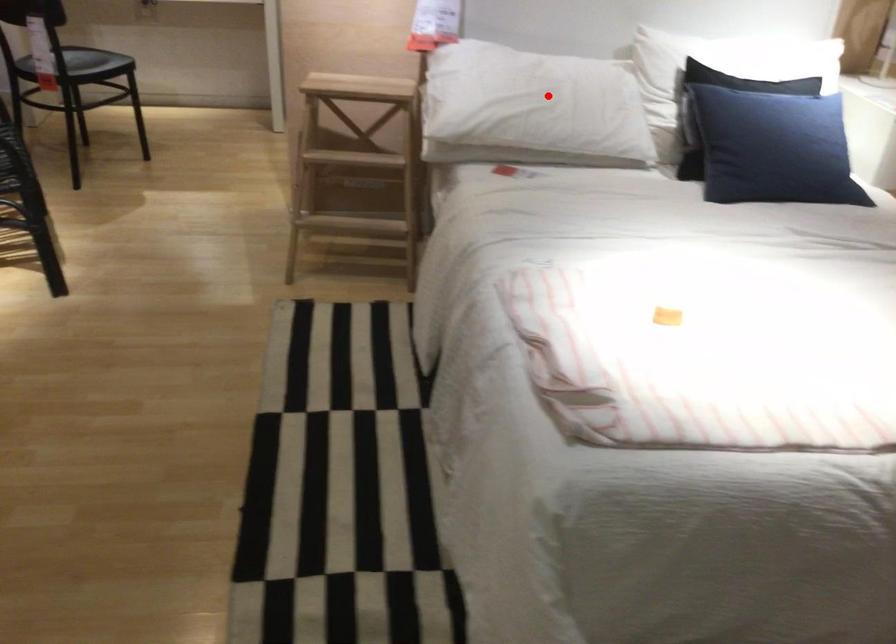
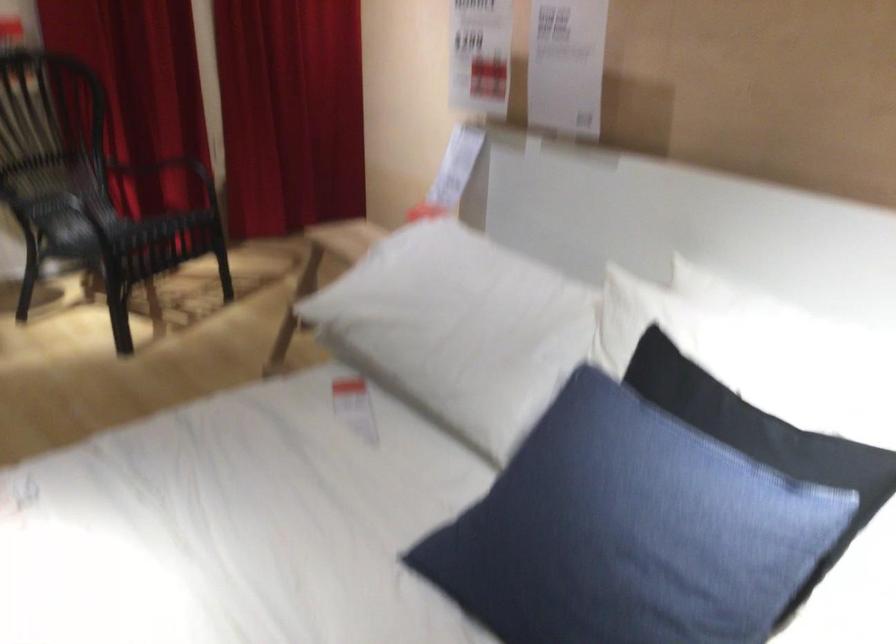
Question: I am providing you with two images of the same scene from different viewpoints. Given a red point in image1, look at the same physical point in image2. Is it:

Choices:
 (A) Closer to the viewpoint
 (B) Farther from the viewpoint

Answer: (A)